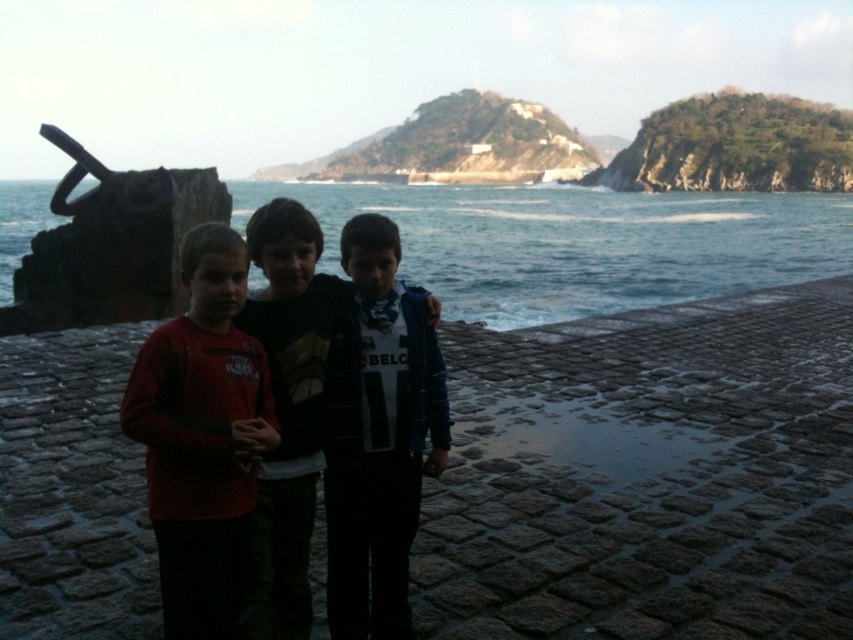
In the scene shown: You are a photographer trying to capture the three children on the cobblestone pathway. You notice a point marked at coordinates (579, 243). Based on the scene, where is this point located in relation to the children and the anchor sculpture?

The point at coordinates (579, 243) is on the blue water at center, which is between the children on the cobblestone pathway and the anchor sculpture on the left side of the image.

You are a photographer trying to capture a wide shot of the scene. Since the blue water at center and the dark blue jersey at center are both in the frame, which one will occupy more of the photo?

The blue water at center is larger in size than the dark blue jersey at center, so it will occupy more of the photo.